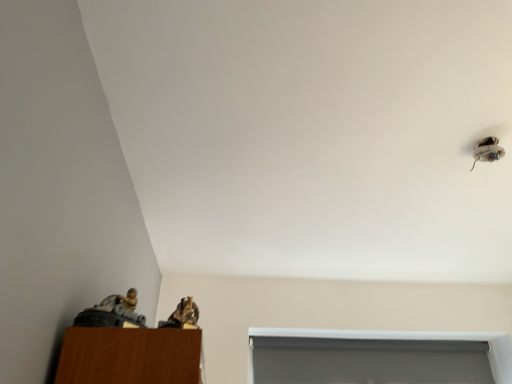
Question: Is the position of brown textured figurine at lower left more distant than that of white matte window at lower center?

Choices:
 (A) no
 (B) yes

Answer: (A)

Question: From a real-world perspective, does brown textured figurine at lower left stand above white matte window at lower center?

Choices:
 (A) yes
 (B) no

Answer: (B)

Question: Considering the relative sizes of brown textured figurine at lower left and white matte window at lower center in the image provided, is brown textured figurine at lower left taller than white matte window at lower center?

Choices:
 (A) yes
 (B) no

Answer: (B)

Question: Can you confirm if brown textured figurine at lower left is shorter than white matte window at lower center?

Choices:
 (A) yes
 (B) no

Answer: (A)

Question: From a real-world perspective, is brown textured figurine at lower left beneath white matte window at lower center?

Choices:
 (A) no
 (B) yes

Answer: (B)

Question: Is brown textured figurine at lower left taller or shorter than white matte window at lower center?

Choices:
 (A) tall
 (B) short

Answer: (B)

Question: Relative to white matte window at lower center, is brown textured figurine at lower left in front or behind?

Choices:
 (A) front
 (B) behind

Answer: (A)

Question: Would you say brown textured figurine at lower left is inside or outside white matte window at lower center?

Choices:
 (A) outside
 (B) inside

Answer: (A)

Question: Considering the positions of brown textured figurine at lower left and white matte window at lower center in the image, is brown textured figurine at lower left wider or thinner than white matte window at lower center?

Choices:
 (A) wide
 (B) thin

Answer: (A)

Question: Is white matte window at lower center spatially inside brown textured figurine at lower left, or outside of it?

Choices:
 (A) inside
 (B) outside

Answer: (B)

Question: In terms of height, does white matte window at lower center look taller or shorter compared to brown textured figurine at lower left?

Choices:
 (A) short
 (B) tall

Answer: (B)

Question: Is white matte window at lower center in front of or behind brown textured figurine at lower left in the image?

Choices:
 (A) front
 (B) behind

Answer: (B)

Question: Considering the positions of point (507, 355) and point (183, 317), is point (507, 355) closer or farther from the camera than point (183, 317)?

Choices:
 (A) farther
 (B) closer

Answer: (A)

Question: In the image, is white glossy shoe at upper right on the left side or the right side of white matte window at lower center?

Choices:
 (A) left
 (B) right

Answer: (B)

Question: Looking at their shapes, would you say white glossy shoe at upper right is wider or thinner than white matte window at lower center?

Choices:
 (A) thin
 (B) wide

Answer: (B)